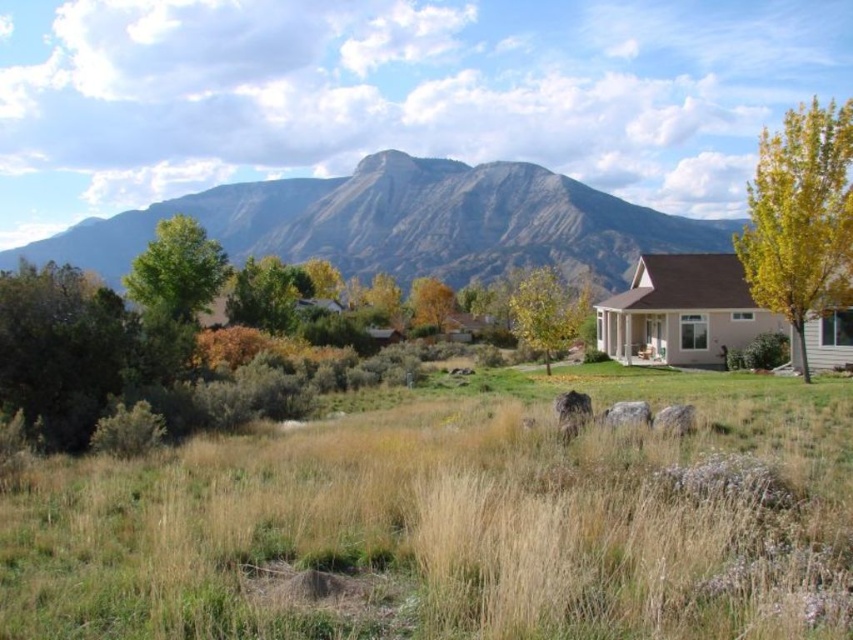
Question: Can you confirm if green leafy tree at center is smaller than yellow-green foliage at right?

Choices:
 (A) yes
 (B) no

Answer: (A)

Question: Among these objects, which one is farthest from the camera?

Choices:
 (A) yellow-green foliage at right
 (B) yellow-green foliage at center
 (C) dry grass at center

Answer: (B)

Question: Does yellow-green foliage at center have a lesser width compared to yellow leafy tree at center?

Choices:
 (A) yes
 (B) no

Answer: (B)

Question: Based on their relative distances, which object is farther from the green leafy tree at center?

Choices:
 (A) rugged brown mountain at upper center
 (B) yellow-green foliage at right

Answer: (B)

Question: Which is nearer to the yellow leafy tree at center?

Choices:
 (A) yellow-green foliage at center
 (B) green leafy tree at center
 (C) dry grass at center

Answer: (A)

Question: Is yellow-green foliage at right further to camera compared to yellow leafy tree at center?

Choices:
 (A) no
 (B) yes

Answer: (A)